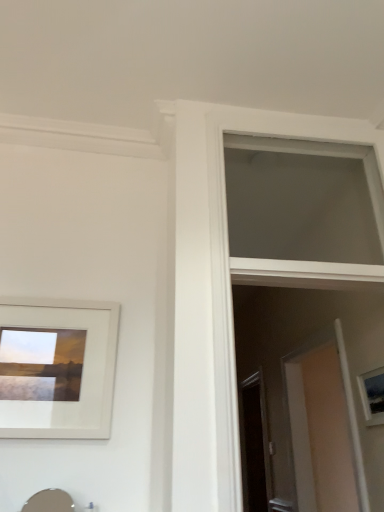
Question: From a real-world perspective, is matte white picture frame at right, which is the first picture frame in right-to-left order, above or below white matte picture frame at upper left, the 1th picture frame in the left-to-right sequence?

Choices:
 (A) above
 (B) below

Answer: (B)

Question: Is matte white picture frame at right, which is counted as the first picture frame, starting from the back, in front of or behind white matte picture frame at upper left, the 2th picture frame when ordered from right to left, in the image?

Choices:
 (A) behind
 (B) front

Answer: (A)

Question: Which object is the closest to the matte silver sink at lower left?

Choices:
 (A) transparent glass screen door at center
 (B) white matte window at upper center
 (C) white matte picture frame at upper left, arranged as the 2th picture frame when viewed from the back
 (D) matte white picture frame at right, placed as the 2th picture frame when sorted from left to right

Answer: (C)

Question: Based on their relative distances, which object is farther from the matte silver sink at lower left?

Choices:
 (A) matte white picture frame at right, which is counted as the first picture frame, starting from the back
 (B) transparent glass screen door at center
 (C) white matte window at upper center
 (D) white matte picture frame at upper left, the 2th picture frame when ordered from right to left

Answer: (C)